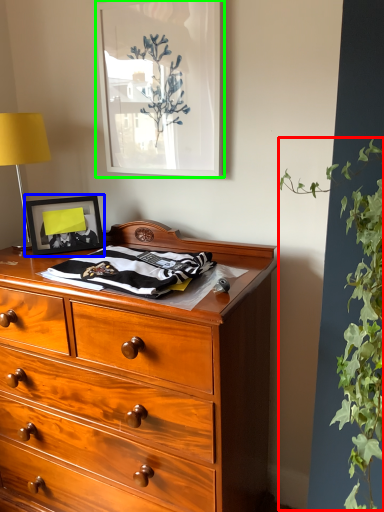
Question: Which object is positioned closest to vegetation (highlighted by a red box)? Select from picture frame (highlighted by a blue box) and picture frame (highlighted by a green box).

Choices:
 (A) picture frame
 (B) picture frame

Answer: (B)